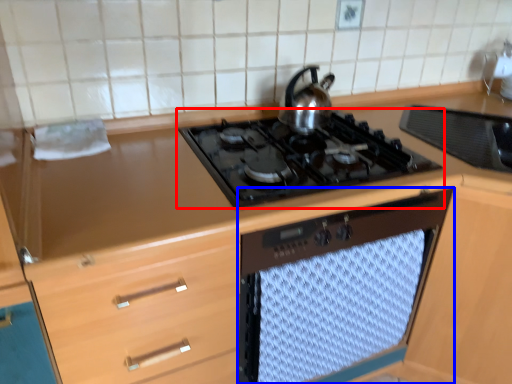
Question: Which object is further to the camera taking this photo, gas stove (highlighted by a red box) or oven (highlighted by a blue box)?

Choices:
 (A) gas stove
 (B) oven

Answer: (B)